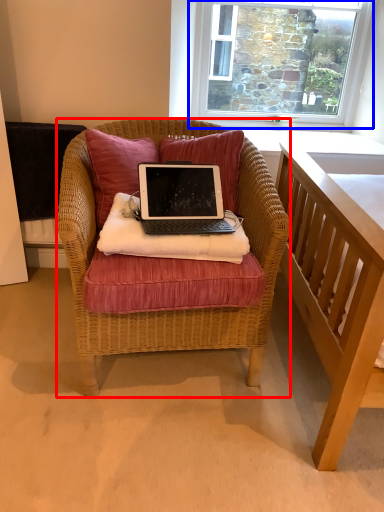
Question: Which point is further to the camera, chair (highlighted by a red box) or window (highlighted by a blue box)?

Choices:
 (A) chair
 (B) window

Answer: (B)